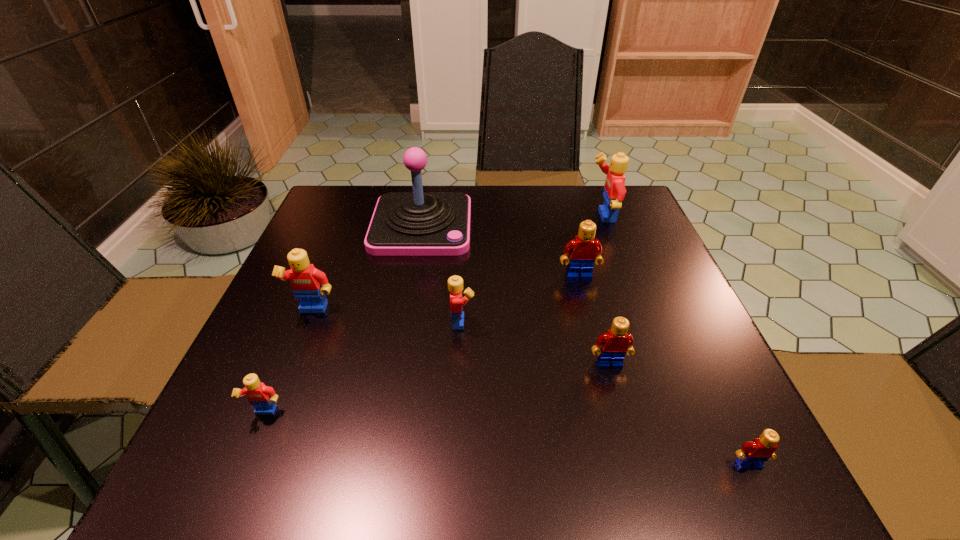
At what (x,y) coordinates should I click in order to perform the action: click on the second nearest red Lego. Please return your answer as a coordinate pair (x, y). Looking at the image, I should click on (615, 343).

Find the location of a particular element. the sixth farthest Lego is located at coordinates (263, 398).

Where is `the nearest yellow Lego`? the nearest yellow Lego is located at coordinates (263, 398).

Identify the location of the nearest Lego. Image resolution: width=960 pixels, height=540 pixels. (752, 455).

Locate an element on the screen. This screenshot has height=540, width=960. the rightmost object is located at coordinates (752, 455).

Locate an element on the screen. The image size is (960, 540). vacant region located 0.120m forward from the base of the joystick is located at coordinates (410, 290).

I want to click on vacant region located on the face of the farthest yellow Lego, so click(x=551, y=217).

The image size is (960, 540). What are the coordinates of `blank space located 0.220m on the face of the farthest yellow Lego` in the screenshot? It's located at (506, 217).

This screenshot has width=960, height=540. In order to click on free space located 0.400m on the face of the farthest yellow Lego in this screenshot , I will do `click(440, 217)`.

Locate an element on the screen. The height and width of the screenshot is (540, 960). free space located 0.060m on the front-facing side of the biggest red Lego is located at coordinates (585, 301).